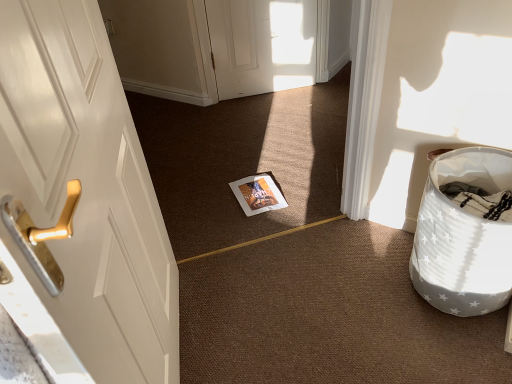
Question: In the image, is white star-patterned laundry basket at right positioned in front of or behind matte paper magazine at center?

Choices:
 (A) front
 (B) behind

Answer: (A)

Question: In terms of size, does white star-patterned laundry basket at right appear bigger or smaller than matte paper magazine at center?

Choices:
 (A) big
 (B) small

Answer: (A)

Question: Is white star-patterned laundry basket at right wider or thinner than matte paper magazine at center?

Choices:
 (A) thin
 (B) wide

Answer: (B)

Question: Would you say matte paper magazine at center is inside or outside white star-patterned laundry basket at right?

Choices:
 (A) outside
 (B) inside

Answer: (A)

Question: Based on their sizes in the image, would you say matte paper magazine at center is bigger or smaller than white star-patterned laundry basket at right?

Choices:
 (A) small
 (B) big

Answer: (A)

Question: Is matte paper magazine at center to the left or to the right of white star-patterned laundry basket at right in the image?

Choices:
 (A) left
 (B) right

Answer: (A)

Question: Is point (260, 182) closer or farther from the camera than point (438, 157)?

Choices:
 (A) farther
 (B) closer

Answer: (A)